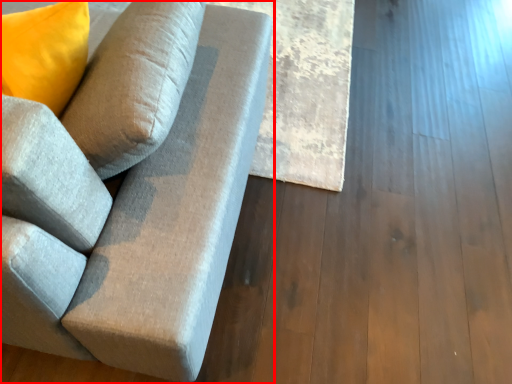
Question: Where is studio couch (annotated by the red box) located in relation to plank in the image?

Choices:
 (A) left
 (B) right

Answer: (A)